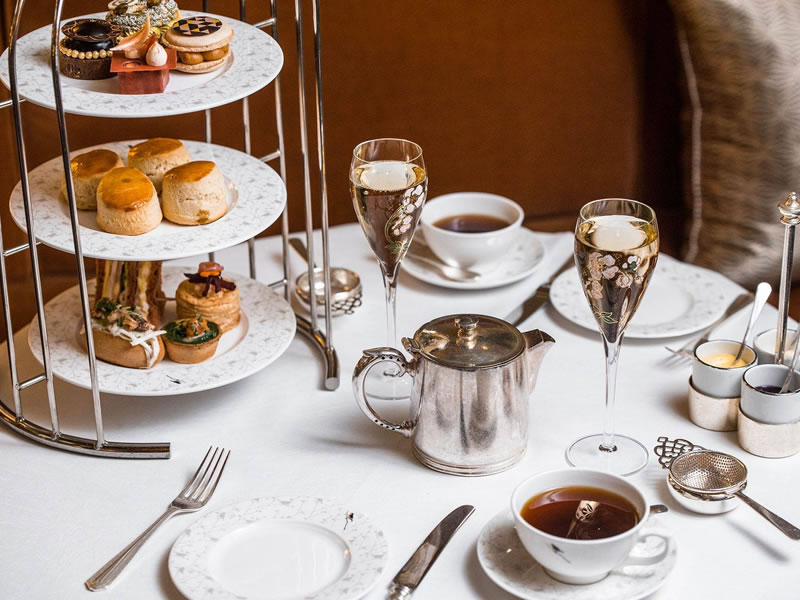
Image resolution: width=800 pixels, height=600 pixels. Find the location of `plate`. plate is located at coordinates (268, 211).